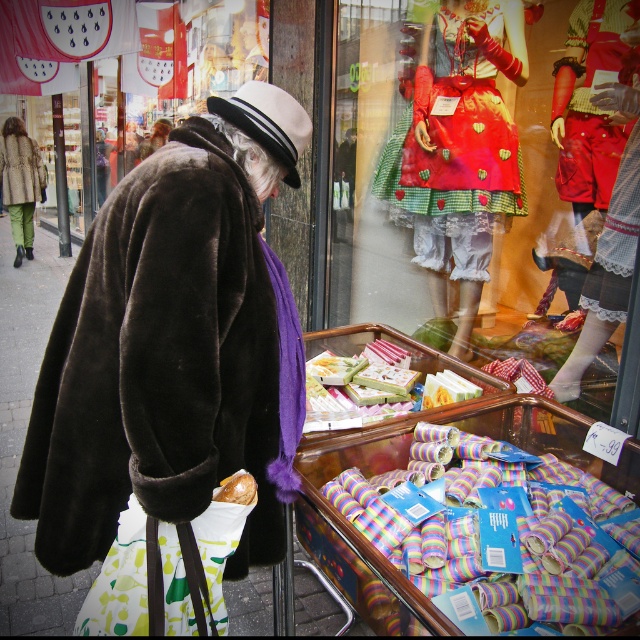
Is point (573, 536) positioned after point (26, 160)?

No, it is in front of (26, 160).

The image size is (640, 640). What do you see at coordinates (512, 536) in the screenshot? I see `multicolored striped candy rolls at lower right` at bounding box center [512, 536].

At what (x,y) coordinates should I click in order to perform the action: click on multicolored striped candy rolls at lower right. Please return your answer as a coordinate pair (x, y). This screenshot has height=640, width=640. Looking at the image, I should click on tap(512, 536).

Between white felt hat at center and gold foil candy at lower center, which one appears on the right side from the viewer's perspective?

Positioned to the right is white felt hat at center.

The image size is (640, 640). What do you see at coordinates (268, 122) in the screenshot? I see `white felt hat at center` at bounding box center [268, 122].

Image resolution: width=640 pixels, height=640 pixels. I want to click on white felt hat at center, so click(268, 122).

Does velvety brown coat at center lie behind green corduroy pants at left?

No, it is in front of green corduroy pants at left.

Between velvety brown coat at center and green corduroy pants at left, which one appears on the left side from the viewer's perspective?

Positioned to the left is green corduroy pants at left.

Which is in front, point (51, 541) or point (28, 166)?

Point (51, 541) is in front.

Where is `velvety brown coat at center`? velvety brown coat at center is located at coordinates (170, 342).